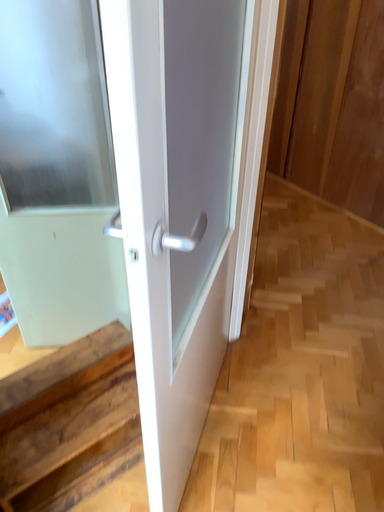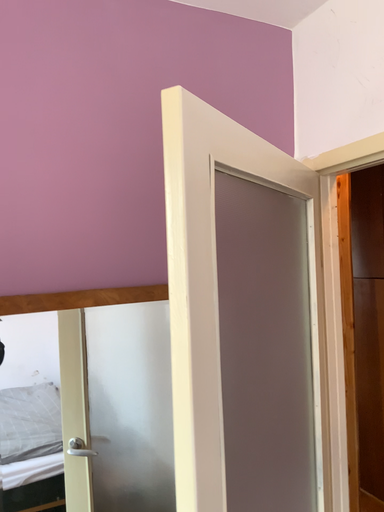
Question: Which way did the camera rotate in the video?

Choices:
 (A) rotated left
 (B) rotated right

Answer: (A)